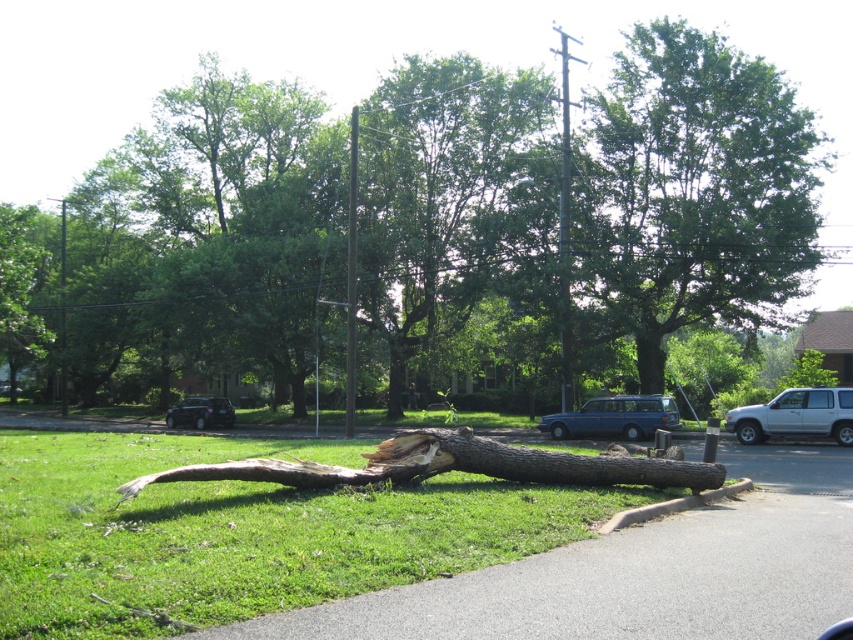
You are a drone operator trying to capture aerial footage of the fallen tree trunk. You notice two points marked on your screen at coordinates point (628, 422) and point (230, 416). Which point is closer to your drone camera lens?

Point (628, 422) is closer to the camera than point (230, 416).

You are a gardener who needs to mow the lawn. You see the green grass at lower left and the brown rough wood log at center. Which area should you avoid mowing?

You should avoid mowing the brown rough wood log at center because it is a log and not grass. The green grass at lower left is the area meant for mowing.